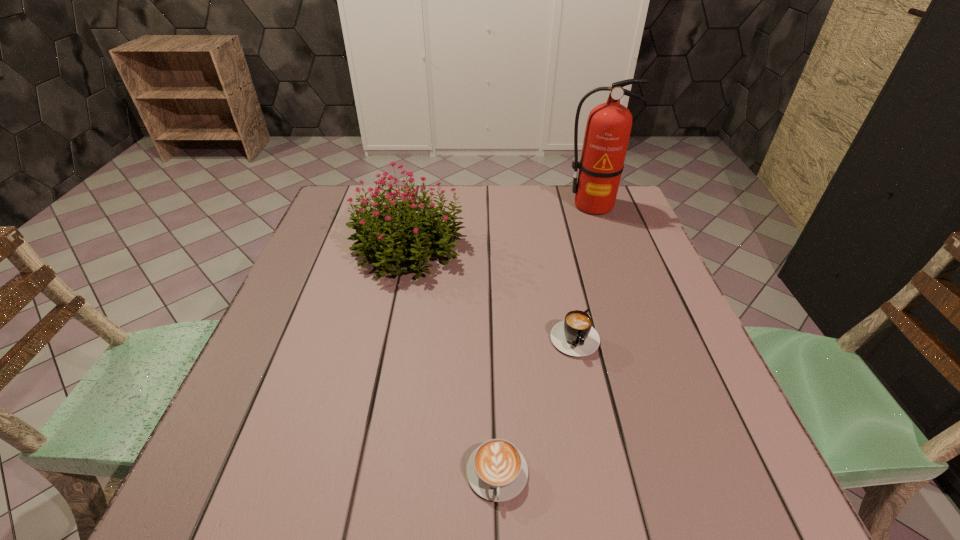
The image size is (960, 540). I want to click on fire extinguisher located at the far edge, so click(608, 128).

Where is `bouquet that is at the far edge`? This screenshot has height=540, width=960. bouquet that is at the far edge is located at coordinates (413, 233).

What are the coordinates of `object that is at the near edge` in the screenshot? It's located at (497, 471).

The image size is (960, 540). In order to click on object located in the left edge section of the desktop in this screenshot , I will do `click(413, 233)`.

Image resolution: width=960 pixels, height=540 pixels. Find the location of `object located at the right edge`. object located at the right edge is located at coordinates (608, 128).

Locate an element on the screen. The image size is (960, 540). object present at the far left corner is located at coordinates (413, 233).

The width and height of the screenshot is (960, 540). I want to click on object at the far right corner, so click(x=608, y=128).

In the image, there is a desktop. Identify the location of vacant space at the far edge. Image resolution: width=960 pixels, height=540 pixels. (529, 217).

In the image, there is a desktop. Identify the location of vacant space at the left edge. (279, 356).

You are a GUI agent. You are given a task and a screenshot of the screen. Output one action in this format:
    pyautogui.click(x=<x>, y=<y>)
    Task: Click on the blank space at the right edge
    
    Given the screenshot: What is the action you would take?
    pyautogui.click(x=628, y=319)